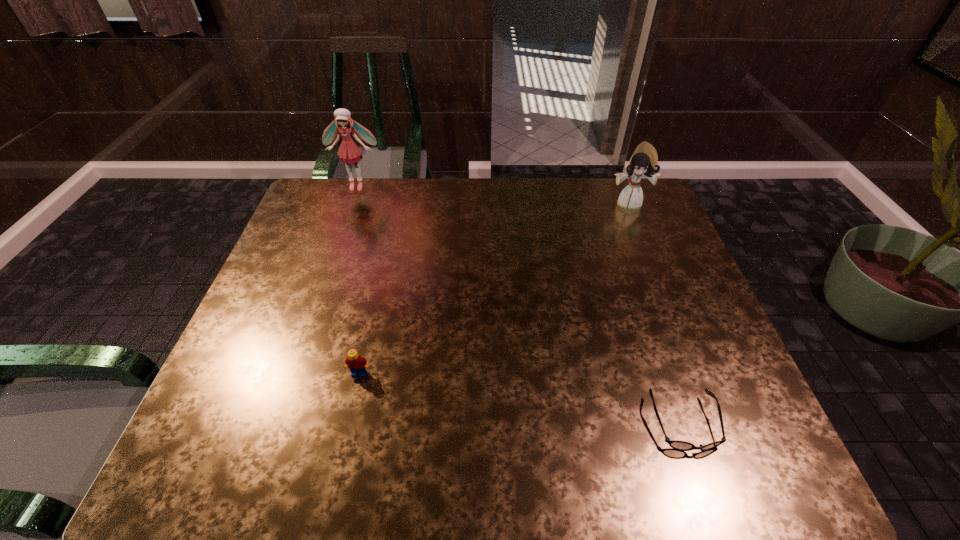
You are a GUI agent. You are given a task and a screenshot of the screen. Output one action in this format:
    pyautogui.click(x=<x>, y=<y>)
    Task: Click on the free space at the left edge
    The image size is (960, 540).
    Given the screenshot: What is the action you would take?
    pyautogui.click(x=289, y=254)

Find the location of `vacant area at the right edge`. vacant area at the right edge is located at coordinates (661, 303).

The width and height of the screenshot is (960, 540). Identify the location of free region at the far left corner of the desktop. (326, 222).

Locate an element on the screen. This screenshot has width=960, height=540. blank area at the far right corner is located at coordinates (607, 184).

The width and height of the screenshot is (960, 540). What are the coordinates of `vacant region between the third object from right to left and the right doll` in the screenshot? It's located at (493, 288).

At what (x,y) coordinates should I click in order to perform the action: click on vacant space that is in between the nearest object and the Lego. Please return your answer as a coordinate pair (x, y). This screenshot has height=540, width=960. Looking at the image, I should click on (521, 399).

You are a GUI agent. You are given a task and a screenshot of the screen. Output one action in this format:
    pyautogui.click(x=<x>, y=<y>)
    Task: Click on the free space between the nearer doll and the left doll
    
    Given the screenshot: What is the action you would take?
    pos(492,194)

You are a GUI agent. You are given a task and a screenshot of the screen. Output one action in this format:
    pyautogui.click(x=<x>, y=<y>)
    Task: Click on the vacant area that lies between the farthest object and the third shortest object
    
    Given the screenshot: What is the action you would take?
    pyautogui.click(x=492, y=194)

Identify the location of free space between the shorter doll and the taller doll. (492, 194).

I want to click on vacant space in between the nearer doll and the sunglasses, so click(x=656, y=313).